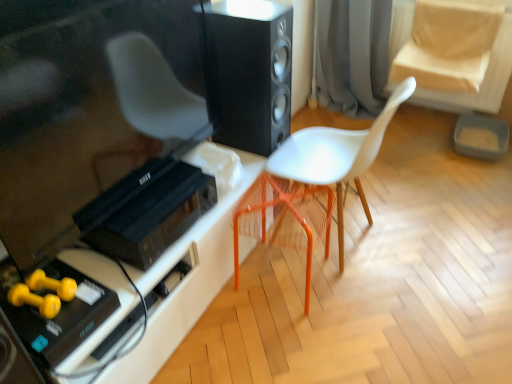
Locate an element on the screen. Image resolution: width=512 pixels, height=384 pixels. vacant region to the right of white plastic table at lower left is located at coordinates (329, 322).